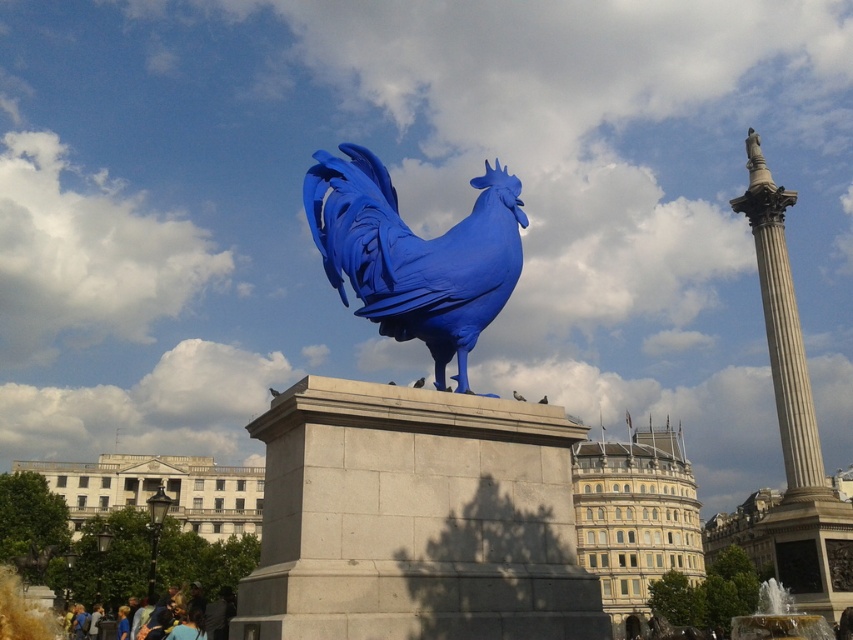
Which is above, matte blue rooster at center or marble column at right?

Positioned higher is matte blue rooster at center.

In the scene shown: Who is more distant from viewer, (352, 244) or (776, 388)?

Positioned behind is point (776, 388).

At what (x,y) coordinates should I click in order to perform the action: click on matte blue rooster at center. Please return your answer as a coordinate pair (x, y). This screenshot has width=853, height=640. Looking at the image, I should click on (415, 253).

Does smooth stone pedestal at center lie behind marble column at right?

That is False.

Is smooth stone pedestal at center thinner than marble column at right?

No.

Is point (369, 540) behind point (845, 536)?

No, it is in front of (845, 536).

This screenshot has width=853, height=640. In order to click on smooth stone pedestal at center in this screenshot , I will do 415,518.

How much distance is there between smooth stone pedestal at center and matte blue rooster at center?

The distance of smooth stone pedestal at center from matte blue rooster at center is 4.96 meters.

Does smooth stone pedestal at center appear on the right side of matte blue rooster at center?

In fact, smooth stone pedestal at center is to the left of matte blue rooster at center.

Does point (286, 616) come farther from viewer compared to point (473, 256)?

No, it is in front of (473, 256).

The width and height of the screenshot is (853, 640). Identify the location of smooth stone pedestal at center. (415, 518).